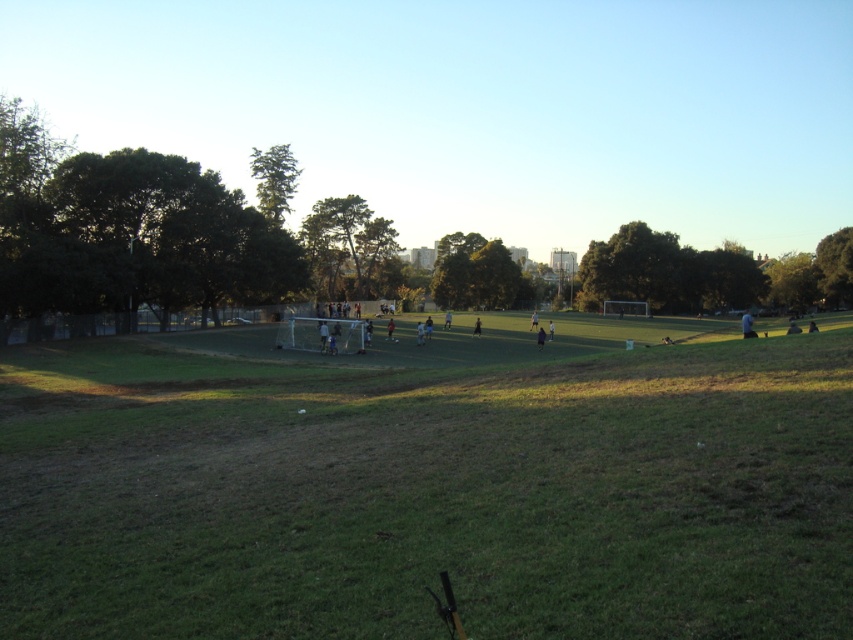
Question: Estimate the real-world distances between objects in this image. Which object is farther from the light blue shirt at center?

Choices:
 (A) dark blue jersey at center
 (B) black fabric person at center
 (C) green grassy field at center

Answer: (A)

Question: Is light blue shirt at center bigger than dark blue jersey at center?

Choices:
 (A) no
 (B) yes

Answer: (B)

Question: Does green grassy field at center lie in front of light blue shirt at center?

Choices:
 (A) yes
 (B) no

Answer: (A)

Question: Which point is farther to the camera?

Choices:
 (A) black fabric person at center
 (B) light blue shirt at center

Answer: (A)

Question: Considering the relative positions of green grassy field at center and dark blue jersey at center in the image provided, where is green grassy field at center located with respect to dark blue jersey at center?

Choices:
 (A) below
 (B) above

Answer: (A)

Question: Which point is farther from the camera taking this photo?

Choices:
 (A) (508, 602)
 (B) (750, 314)
 (C) (392, 339)

Answer: (B)